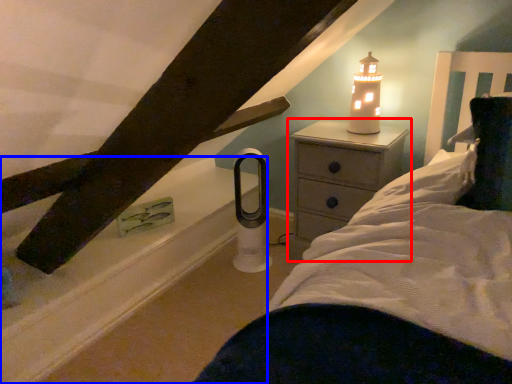
Question: Which point is further to the camera, nightstand (highlighted by a red box) or window sill (highlighted by a blue box)?

Choices:
 (A) nightstand
 (B) window sill

Answer: (A)